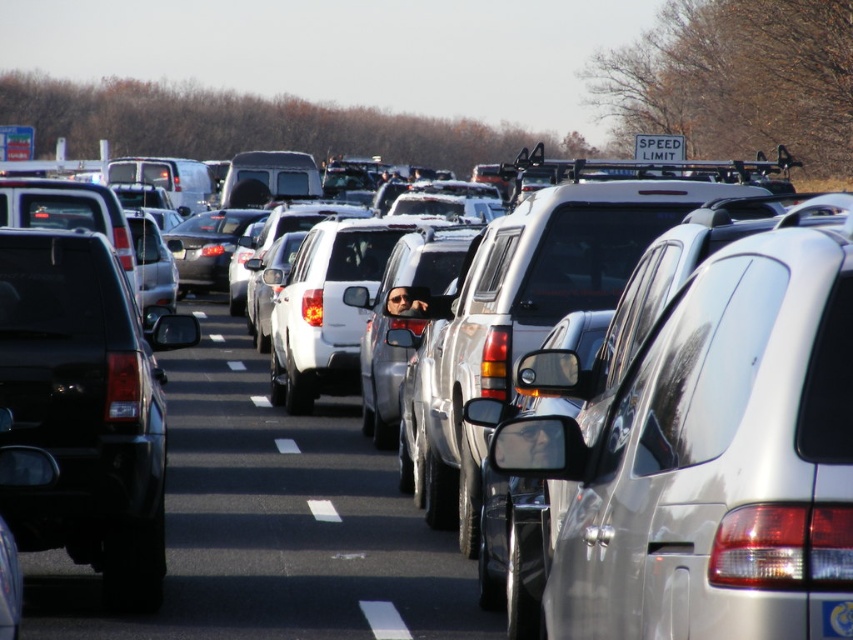
You are a delivery driver who needs to pass through the traffic jam. Your truck is 5 meters long. You see the matte black suv at left and the black plastic license plate at center. Can you fit your truck between them?

The distance between the matte black suv at left and the black plastic license plate at center is 51.69 centimeters, which is much shorter than your 5 meter long truck. Therefore, your truck cannot fit between them.

You are a delivery driver who needs to navigate through the traffic jam. You see a matte black suv at left and a black plastic license plate at center. Which object is closer to the ground?

The matte black suv at left is closer to the ground because it is below the black plastic license plate at center.

From the picture: You are a delivery driver needing to pass through the traffic jam. You see a white glossy car at center and a matte black suv at left. Which vehicle should you avoid if you want to choose the narrower path between them?

You should avoid the white glossy car at center because its width surpasses the matte black suv at left, making the path between them narrower than the path next to the suv.